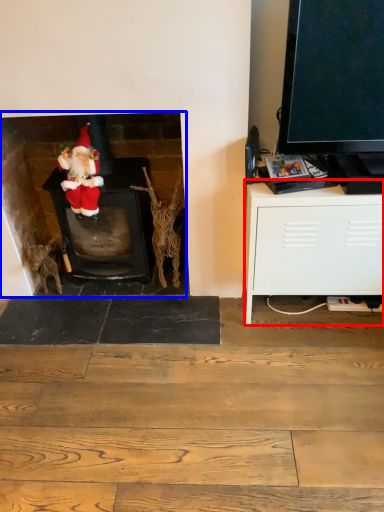
Question: Which object is further to the camera taking this photo, cabinetry (highlighted by a red box) or fireplace (highlighted by a blue box)?

Choices:
 (A) cabinetry
 (B) fireplace

Answer: (B)